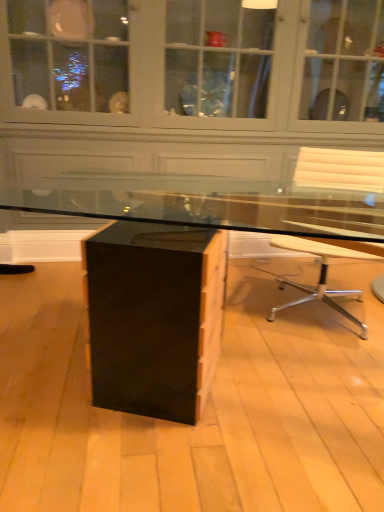
In order to face white leather chair at right, should I rotate leftwards or rightwards?

You should rotate right by 17.708 degrees.

What do you see at coordinates (340, 170) in the screenshot? I see `white leather chair at right` at bounding box center [340, 170].

I want to click on matte black desk at center, so click(154, 315).

Locate an element on the screen. The width and height of the screenshot is (384, 512). chair above the matte black desk at center (from a real-world perspective) is located at coordinates (340, 170).

Based on the photo, considering the relative sizes of matte black desk at center and white leather chair at right in the image provided, is matte black desk at center shorter than white leather chair at right?

Yes, matte black desk at center is shorter than white leather chair at right.

Does point (175, 380) appear closer or farther from the camera than point (328, 246)?

Clearly, point (175, 380) is more distant from the camera than point (328, 246).

Is matte black desk at center not inside black glossy dresser at center?

Indeed, matte black desk at center is completely outside black glossy dresser at center.

Can you tell me how much matte black desk at center and black glossy dresser at center differ in facing direction?

matte black desk at center and black glossy dresser at center are facing 159 degrees away from each other.

From a real-world perspective, between matte black desk at center and black glossy dresser at center, who is vertically higher?

black glossy dresser at center, from a real-world perspective.

Which is more to the left, matte black desk at center or black glossy dresser at center?

black glossy dresser at center.

From the image's perspective, is black glossy dresser at center positioned above or below matte black desk at center?

black glossy dresser at center is above matte black desk at center.

From a real-world perspective, is black glossy dresser at center located beneath matte black desk at center?

No, from a real-world perspective, black glossy dresser at center is not under matte black desk at center.

Considering the relative sizes of black glossy dresser at center and matte black desk at center in the image provided, is black glossy dresser at center thinner than matte black desk at center?

Yes.

From the image's perspective, is white leather chair at right above black glossy dresser at center?

No.

Which is more to the left, white leather chair at right or black glossy dresser at center?

Positioned to the left is black glossy dresser at center.

Looking at the image, does white leather chair at right seem bigger or smaller compared to black glossy dresser at center?

In the image, white leather chair at right appears to be smaller than black glossy dresser at center.

How many degrees apart are the facing directions of black glossy dresser at center and white leather chair at right?

The angle between the facing direction of black glossy dresser at center and the facing direction of white leather chair at right is 28.6 degrees.

In terms of height, does black glossy dresser at center look taller or shorter compared to white leather chair at right?

In the image, black glossy dresser at center appears to be taller than white leather chair at right.

Considering the positions of objects black glossy dresser at center and white leather chair at right in the image provided, who is more to the left, black glossy dresser at center or white leather chair at right?

Positioned to the left is black glossy dresser at center.

Which is farther, [360,189] or [305,247]?

The point [360,189] is farther from the camera.

Find the location of a particular element. desk lying below the white leather chair at right (from the image's perspective) is located at coordinates (154, 315).

How distant is white leather chair at right from matte black desk at center?

white leather chair at right is 38.23 inches from matte black desk at center.

Can you confirm if white leather chair at right is positioned to the right of matte black desk at center?

Correct, you'll find white leather chair at right to the right of matte black desk at center.

Identify the location of desk below the white leather chair at right (from the image's perspective). Image resolution: width=384 pixels, height=512 pixels. (154, 315).

Where is `dresser above the matte black desk at center (from the image's perspective)`? dresser above the matte black desk at center (from the image's perspective) is located at coordinates (196, 112).

Which object lies further to the anchor point white leather chair at right, black glossy dresser at center or matte black desk at center?

black glossy dresser at center is positioned further to the anchor white leather chair at right.

Based on their spatial positions, is white leather chair at right or black glossy dresser at center further from matte black desk at center?

Based on the image, black glossy dresser at center appears to be further to matte black desk at center.

Estimate the real-world distances between objects in this image. Which object is further from black glossy dresser at center, matte black desk at center or white leather chair at right?

The object further to black glossy dresser at center is matte black desk at center.

Based on their spatial positions, is matte black desk at center or black glossy dresser at center further from white leather chair at right?

The object further to white leather chair at right is black glossy dresser at center.

Which object lies further to the anchor point matte black desk at center, black glossy dresser at center or white leather chair at right?

Based on the image, black glossy dresser at center appears to be further to matte black desk at center.

From the image, which object appears to be nearer to black glossy dresser at center, white leather chair at right or matte black desk at center?

white leather chair at right is closer to black glossy dresser at center.

You are a GUI agent. You are given a task and a screenshot of the screen. Output one action in this format:
    pyautogui.click(x=<x>, y=<y>)
    Task: Click on the chair positioned between matte black desk at center and black glossy dresser at center from near to far
    The image size is (384, 512).
    Given the screenshot: What is the action you would take?
    pyautogui.click(x=340, y=170)